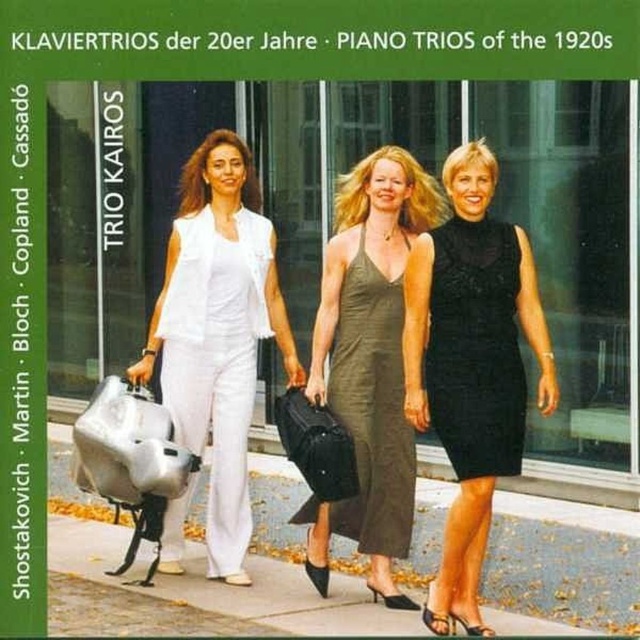
You are a photographer setting up a shoot in the described scene. You need to ensure that the white matte vest at center and the black lace dress at right are both visible in the frame. Given their sizes, which object should you focus on first to ensure proper framing?

The white matte vest at center should be focused on first since it has a larger size compared to the black lace dress at right, ensuring it fits well in the frame before adjusting for the smaller one.

You are standing in the scene and want to walk towards the closest point between the two points, point (468, 202) and point (474, 310). Which point should you head towards?

Point (468, 202) is closer to you than point (474, 310), so you should head towards point (468, 202).